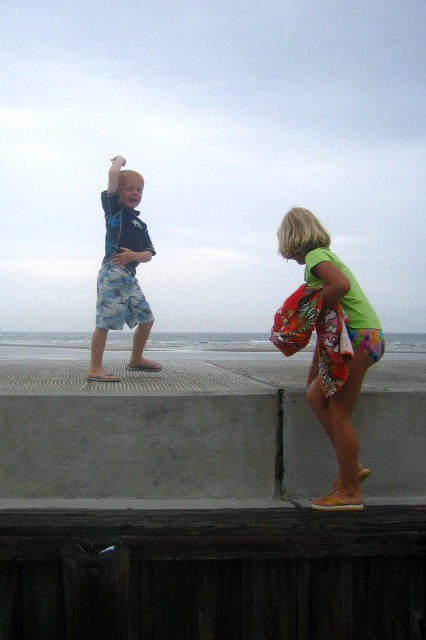
Question: Can you confirm if gray concrete at lower center is positioned to the right of blue camouflage shorts at left?

Choices:
 (A) no
 (B) yes

Answer: (B)

Question: Is gray concrete at lower center thinner than blue camouflage shorts at left?

Choices:
 (A) no
 (B) yes

Answer: (A)

Question: Which object is the closest to the floral shorts at center?

Choices:
 (A) blue camouflage shorts at left
 (B) gray concrete at lower center

Answer: (A)

Question: Which object appears closest to the camera in this image?

Choices:
 (A) gray concrete at lower center
 (B) blue camouflage shorts at left

Answer: (A)

Question: Which point is closer to the camera?

Choices:
 (A) (141, 401)
 (B) (112, 193)
 (C) (307, 381)

Answer: (A)

Question: Can you confirm if gray concrete at lower center is positioned to the right of blue camouflage shorts at left?

Choices:
 (A) no
 (B) yes

Answer: (B)